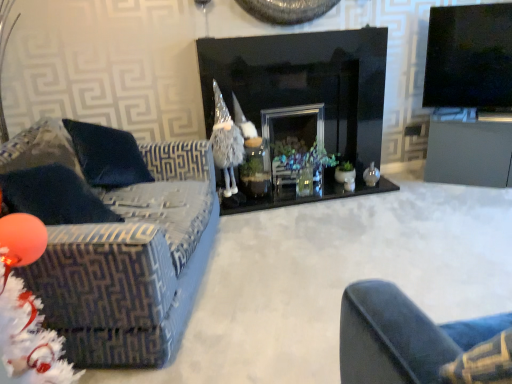
Question: Considering the relative positions of black glossy tv at upper right and velvet-patterned couch at left in the image provided, is black glossy tv at upper right to the left or to the right of velvet-patterned couch at left?

Choices:
 (A) right
 (B) left

Answer: (A)

Question: Is black glossy tv at upper right taller or shorter than velvet-patterned couch at left?

Choices:
 (A) tall
 (B) short

Answer: (B)

Question: Considering the real-world distances, which object is farthest from the black glass fireplace at center?

Choices:
 (A) velvet-patterned couch at left
 (B) translucent glass vase at center
 (C) matte gray table at right
 (D) black glossy tv at upper right

Answer: (A)

Question: Which object is positioned closest to the black glass fireplace at center?

Choices:
 (A) velvet-patterned couch at left
 (B) translucent glass vase at center
 (C) black glossy tv at upper right
 (D) matte gray table at right

Answer: (B)